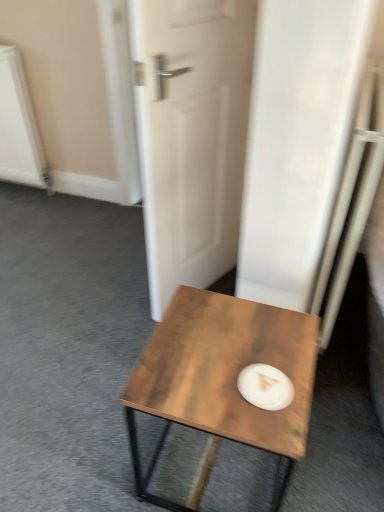
You are a GUI agent. You are given a task and a screenshot of the screen. Output one action in this format:
    pyautogui.click(x=<x>, y=<y>)
    Task: Click on the vacant area located to the right-hand side of white matte paper plate at center
    
    Given the screenshot: What is the action you would take?
    pyautogui.click(x=299, y=378)